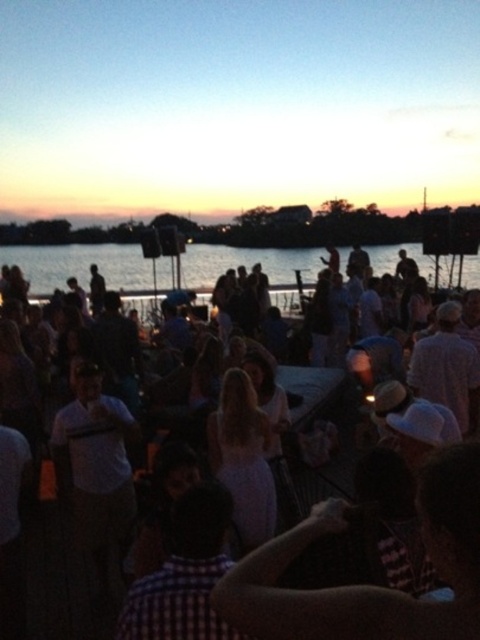
You are standing at the camera position and want to hand a flower to the person wearing the white cotton dress at center. Can you reach them without moving from your current position?

The white cotton dress at center is 5.89 meters away from camera, so you cannot reach them without moving from your current position.